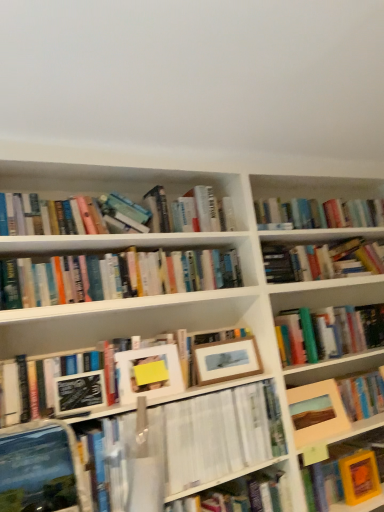
Question: Does orange matte book at lower right, which ranks as the 1th paperback book in right-to-left order, have a lesser height compared to wooden picture frame at center right, the third picture frame positioned from the left?

Choices:
 (A) yes
 (B) no

Answer: (A)

Question: Is orange matte book at lower right, which is the 2th paperback book in front-to-back order, positioned in front of wooden picture frame at center right, the first picture frame positioned from the right?

Choices:
 (A) yes
 (B) no

Answer: (B)

Question: From the image's perspective, is orange matte book at lower right, which ranks as the 1th paperback book in right-to-left order, under wooden picture frame at center right, the first picture frame positioned from the right?

Choices:
 (A) no
 (B) yes

Answer: (B)

Question: Is orange matte book at lower right, the 1th paperback book ordered from the bottom, aimed at wooden picture frame at center right, the first picture frame positioned from the right?

Choices:
 (A) yes
 (B) no

Answer: (B)

Question: Is orange matte book at lower right, the 1th paperback book ordered from the bottom, surrounding wooden picture frame at center right, the first picture frame positioned from the right?

Choices:
 (A) yes
 (B) no

Answer: (B)

Question: Considering the relative sizes of orange matte book at lower right, which appears as the second paperback book when viewed from the left, and wooden picture frame at center right, the third picture frame positioned from the left, in the image provided, is orange matte book at lower right, which appears as the second paperback book when viewed from the left, wider than wooden picture frame at center right, the third picture frame positioned from the left,?

Choices:
 (A) no
 (B) yes

Answer: (A)

Question: Is the surface of hardcover book at center, which appears as the 2th book when ordered from the bottom, in direct contact with matte black paperback book at center-left, the 2th paperback book when ordered from back to front?

Choices:
 (A) no
 (B) yes

Answer: (A)

Question: Is hardcover book at center, which is the 1th book in top-to-bottom order, bigger than matte black paperback book at center-left, the 2th paperback book when ordered from back to front?

Choices:
 (A) yes
 (B) no

Answer: (A)

Question: From the image's perspective, is hardcover book at center, which appears as the 2th book when ordered from the bottom, located above matte black paperback book at center-left, which appears as the first paperback book when viewed from the top?

Choices:
 (A) yes
 (B) no

Answer: (A)

Question: Is hardcover book at center, which is the 1th book in top-to-bottom order, turned away from matte black paperback book at center-left, which appears as the first paperback book when viewed from the top?

Choices:
 (A) no
 (B) yes

Answer: (A)

Question: Can you confirm if hardcover book at center, which appears as the 2th book when ordered from the bottom, is positioned to the left of matte black paperback book at center-left, the 2th paperback book when ordered from back to front?

Choices:
 (A) yes
 (B) no

Answer: (B)

Question: Is hardcover book at center, which appears as the 2th book when ordered from the bottom, far away from matte black paperback book at center-left, which is the 2th paperback book in right-to-left order?

Choices:
 (A) yes
 (B) no

Answer: (B)

Question: Does wooden picture frame at center right, the first picture frame positioned from the right, have a larger size compared to matte black paperback book at center-left, which is the 2th paperback book in right-to-left order?

Choices:
 (A) yes
 (B) no

Answer: (A)